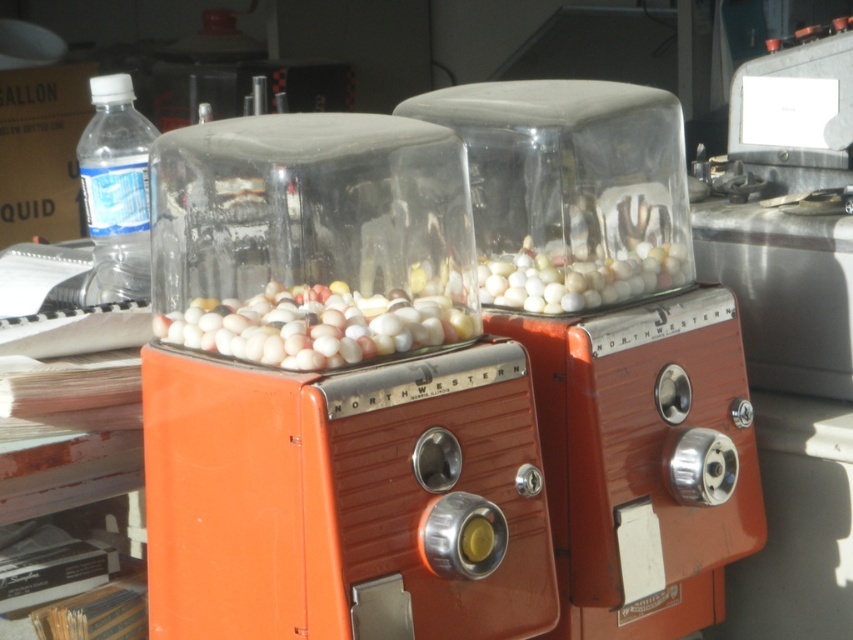
Question: Does metallic silver appliance at right appear over clear plastic bottle at left?

Choices:
 (A) yes
 (B) no

Answer: (B)

Question: Which object is farther from the camera taking this photo?

Choices:
 (A) orange metallic gumball machine at center
 (B) clear plastic bottle at left
 (C) orange metallic northwestern gumball machine at center

Answer: (B)

Question: Does orange metallic gumball machine at center appear over clear plastic bottle at left?

Choices:
 (A) no
 (B) yes

Answer: (A)

Question: Which of the following is the farthest from the observer?

Choices:
 (A) (115, 204)
 (B) (276, 305)
 (C) (776, 131)
 (D) (691, 269)

Answer: (C)

Question: Does orange metallic gumball machine at center lie in front of orange metallic northwestern gumball machine at center?

Choices:
 (A) yes
 (B) no

Answer: (A)

Question: Estimate the real-world distances between objects in this image. Which object is farther from the clear plastic bottle at left?

Choices:
 (A) orange metallic northwestern gumball machine at center
 (B) orange metallic gumball machine at center

Answer: (A)